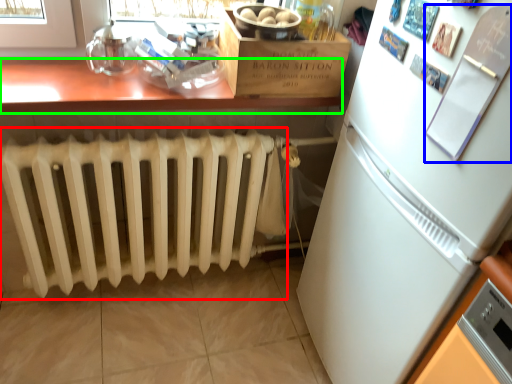
Question: Which object is the farthest from radiator (highlighted by a red box)? Choose among these: bulletin board (highlighted by a blue box) or table (highlighted by a green box).

Choices:
 (A) bulletin board
 (B) table

Answer: (A)